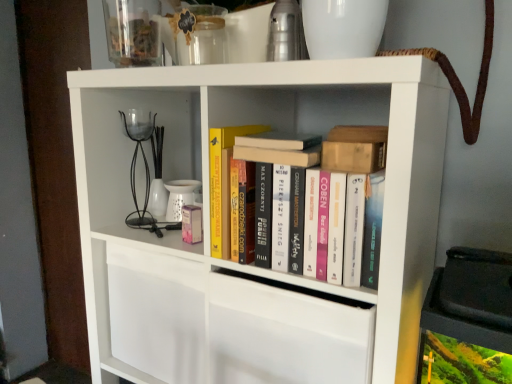
Question: Is hardcover books at center, the 4th book from the top, shorter than hardcover book at center, the 2th book positioned from the top?

Choices:
 (A) yes
 (B) no

Answer: (B)

Question: Is hardcover books at center, the 4th book from the top, aimed at hardcover book at center, the 3th book in the bottom-to-top sequence?

Choices:
 (A) yes
 (B) no

Answer: (B)

Question: Does hardcover books at center, the 1th book from the bottom, contain hardcover book at center, the 2th book positioned from the top?

Choices:
 (A) yes
 (B) no

Answer: (B)

Question: Considering the relative sizes of hardcover books at center, the 1th book from the bottom, and hardcover book at center, the 2th book positioned from the top, in the image provided, is hardcover books at center, the 1th book from the bottom, smaller than hardcover book at center, the 2th book positioned from the top,?

Choices:
 (A) yes
 (B) no

Answer: (B)

Question: Can you confirm if hardcover books at center, the 4th book from the top, is bigger than hardcover book at center, the 2th book positioned from the top?

Choices:
 (A) yes
 (B) no

Answer: (A)

Question: From a real-world perspective, relative to wooden block at upper right, which is the third book from top to bottom, is white matte bookshelf at center vertically above or below?

Choices:
 (A) below
 (B) above

Answer: (A)

Question: Relative to wooden block at upper right, the 2th book when ordered from bottom to top, is white matte bookshelf at center in front or behind?

Choices:
 (A) front
 (B) behind

Answer: (A)

Question: Based on their positions, is white matte bookshelf at center located to the left or right of wooden block at upper right, the 2th book when ordered from bottom to top?

Choices:
 (A) left
 (B) right

Answer: (A)

Question: From the image's perspective, is white matte bookshelf at center positioned above or below wooden block at upper right, the 2th book when ordered from bottom to top?

Choices:
 (A) below
 (B) above

Answer: (A)

Question: Looking at their shapes, would you say transparent glass jar at upper center is wider or thinner than hardcover books at center, the 4th book from the top?

Choices:
 (A) wide
 (B) thin

Answer: (A)

Question: From their relative heights in the image, would you say transparent glass jar at upper center is taller or shorter than hardcover books at center, the 1th book from the bottom?

Choices:
 (A) short
 (B) tall

Answer: (A)

Question: From the image's perspective, is transparent glass jar at upper center located above or below hardcover books at center, the 4th book from the top?

Choices:
 (A) above
 (B) below

Answer: (A)

Question: Is transparent glass jar at upper center in front of or behind hardcover books at center, the 4th book from the top, in the image?

Choices:
 (A) front
 (B) behind

Answer: (B)

Question: Relative to white matte bookshelf at center, is transparent glass jar at upper center in front or behind?

Choices:
 (A) behind
 (B) front

Answer: (A)

Question: In terms of size, does transparent glass jar at upper center appear bigger or smaller than white matte bookshelf at center?

Choices:
 (A) big
 (B) small

Answer: (B)